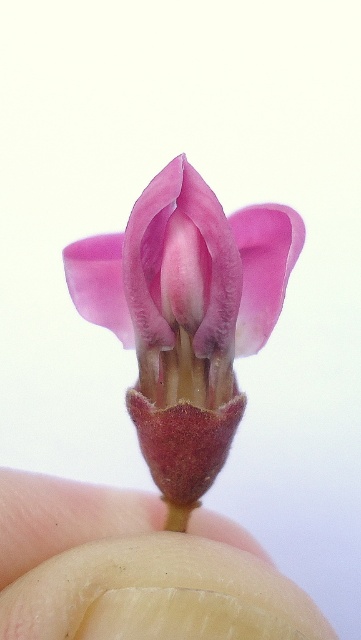
Can you confirm if pink matte flower at center is thinner than smooth beige finger at center?

Yes.

Is point (246, 352) positioned behind point (271, 609)?

Yes, point (246, 352) is behind point (271, 609).

Which is in front, point (289, 252) or point (193, 604)?

Point (193, 604) is more forward.

Locate an element on the screen. Image resolution: width=361 pixels, height=640 pixels. pink matte flower at center is located at coordinates (186, 314).